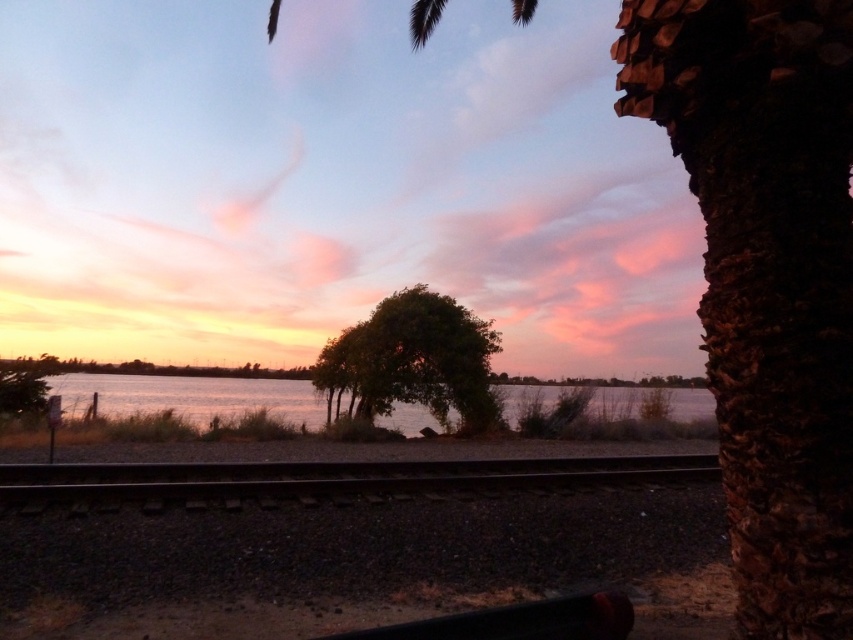
Based on the photo, you are standing at the edge of the railway track and want to walk towards the green leafy tree at center. Which direction should you walk to move away from the smooth metal train track at center?

Since the smooth metal train track at center is closer to the viewer than the green leafy tree at center, you should walk towards the direction of the tree to move away from the track.

You are standing at the edge of the railway track and want to cross to the other side. The smooth metal train track at center is above the silvery reflective water at center. Can you step onto the water to cross the track?

The smooth metal train track at center is located above the silvery reflective water at center, so you cannot step onto the water to cross the track because the track is elevated above it.

You are standing at the edge of the railway track and want to cross to the other side. There is a silvery reflective water at center behind the smooth metal train track at center. Which object would you encounter first while crossing the track?

You would first encounter the smooth metal train track at center before the silvery reflective water at center since the track is in front of the water.